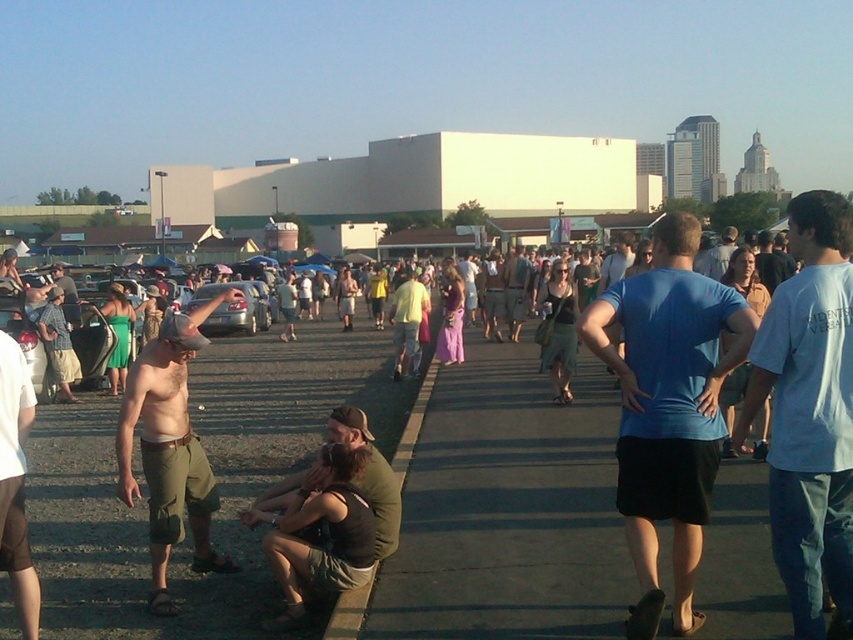
Question: Which object appears farthest from the camera in this image?

Choices:
 (A) green canvas jacket at lower center
 (B) white cotton t-shirt at center-right
 (C) blue t-shirt at center

Answer: (A)

Question: From the image, what is the correct spatial relationship of white cotton t-shirt at center-right in relation to green canvas jacket at lower center?

Choices:
 (A) left
 (B) right

Answer: (B)

Question: Considering the real-world distances, which object is farthest from the blue t-shirt at center?

Choices:
 (A) green canvas jacket at lower center
 (B) white cotton t-shirt at center-right

Answer: (A)

Question: Is blue t-shirt at center smaller than green cotton shorts at lower left?

Choices:
 (A) no
 (B) yes

Answer: (A)

Question: Estimate the real-world distances between objects in this image. Which object is closer to the green canvas jacket at lower center?

Choices:
 (A) blue t-shirt at center
 (B) white cotton t-shirt at center-right
 (C) green cotton shorts at lower left

Answer: (C)

Question: Where is green cotton shorts at lower left located in relation to green canvas jacket at lower center in the image?

Choices:
 (A) right
 (B) left

Answer: (B)